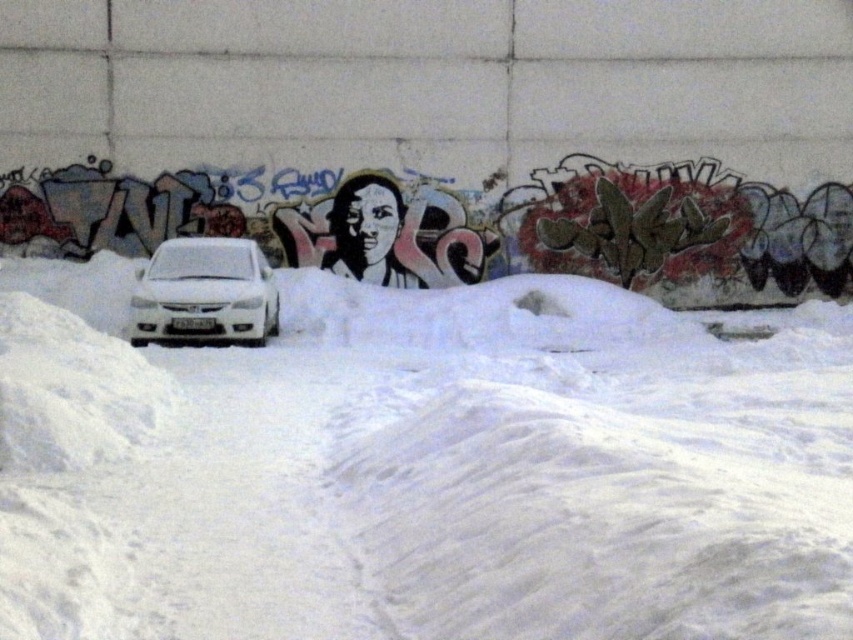
Based on the coordinates provided, where is the white fluffy snow at center located in the image?

The white fluffy snow at center is located at the coordinates point (421, 467).

You are a delivery person trying to reach a package left on the white glossy car at center. The snow is heavy. Based on the scene, will you need to clear the snow from the white fluffy snow at center to access the car?

The white fluffy snow at center has a larger size compared to white glossy car at center, so yes, you need to clear the snow from the white fluffy snow at center to access the white glossy car at center since the snow is covering most of the car.